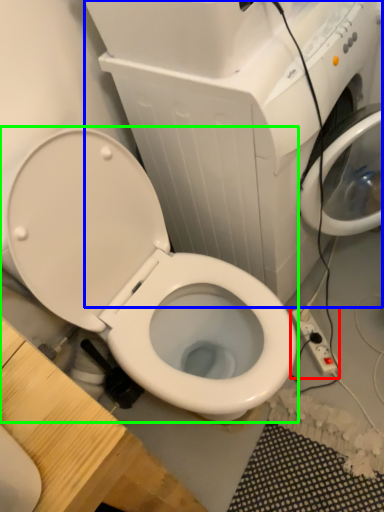
Question: Which is farther away from electric outlet (highlighted by a red box)? appliance (highlighted by a blue box) or toilet (highlighted by a green box)?

Choices:
 (A) appliance
 (B) toilet

Answer: (A)